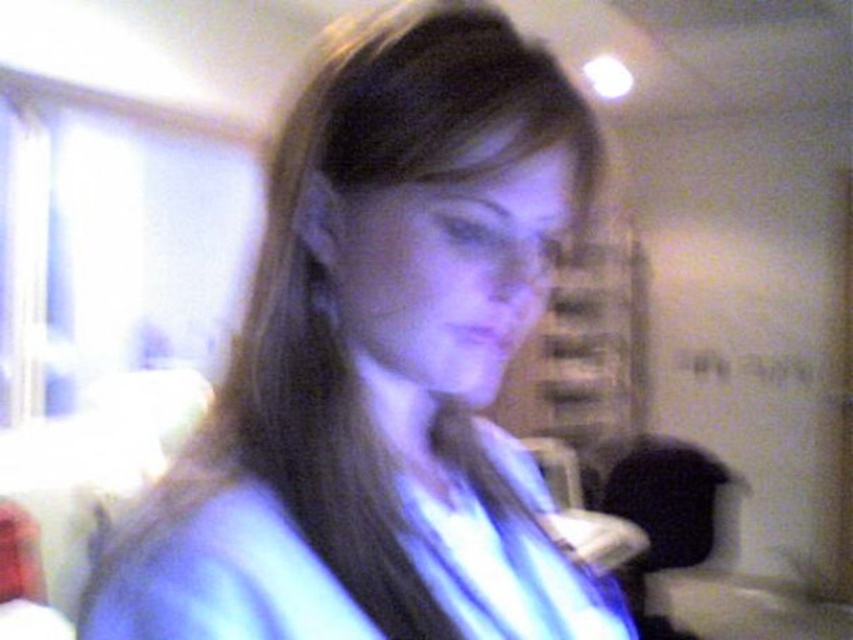
Between point (285, 524) and point (91, 593), which one is positioned behind?

The point (285, 524) is behind.

Between blue fabric shirt at center and blue fabric robe at center, which one has more height?

blue fabric shirt at center

Find the location of `blue fabric shirt at center`. blue fabric shirt at center is located at coordinates (384, 368).

I want to click on blue fabric shirt at center, so click(x=384, y=368).